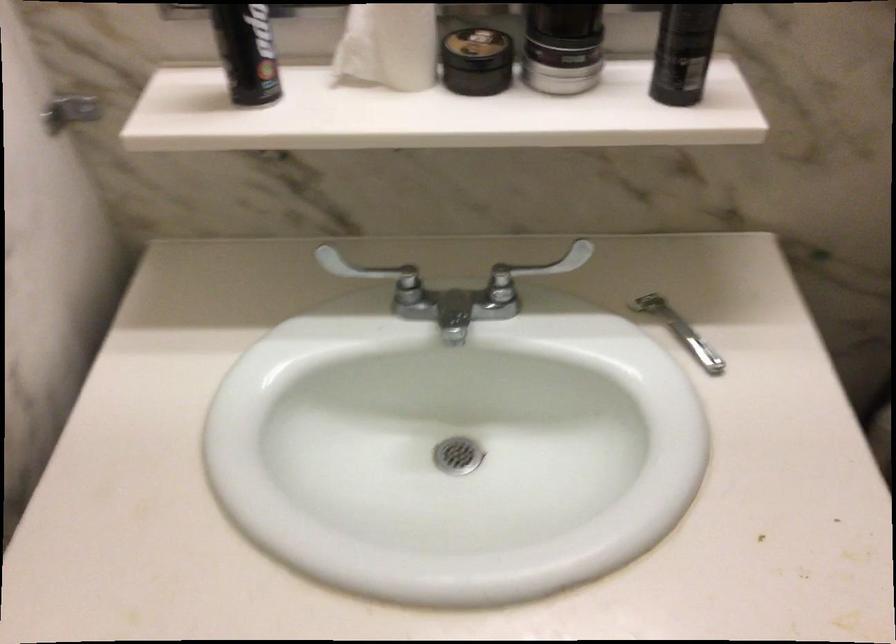
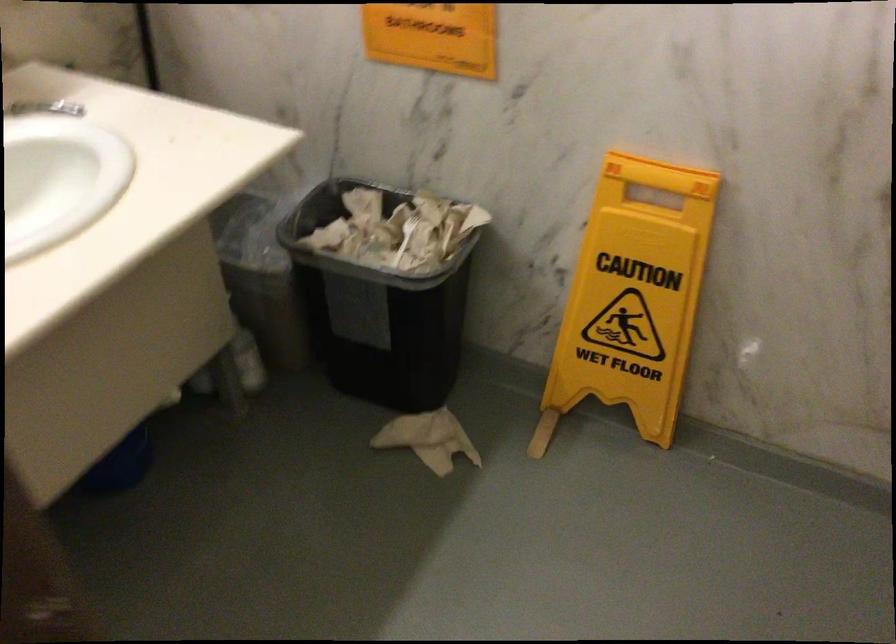
In the second image, find the point that corresponds to pixel 678 317 in the first image.

(45, 108)